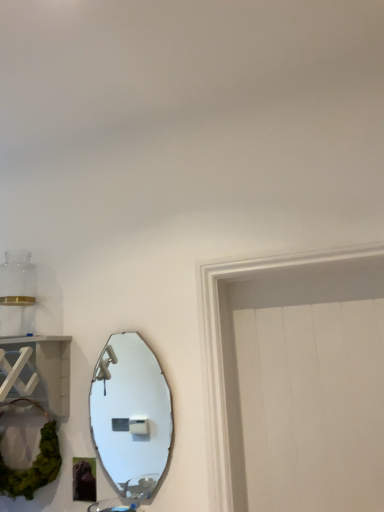
Question: Is matte silver mirror at center-left wider or thinner than white wood shelf at left?

Choices:
 (A) thin
 (B) wide

Answer: (A)

Question: Relative to white wood shelf at left, is matte silver mirror at center-left in front or behind?

Choices:
 (A) front
 (B) behind

Answer: (B)

Question: In terms of height, does matte silver mirror at center-left look taller or shorter compared to white wood shelf at left?

Choices:
 (A) short
 (B) tall

Answer: (B)

Question: From the image's perspective, is white wood shelf at left above or below matte silver mirror at center-left?

Choices:
 (A) above
 (B) below

Answer: (A)

Question: Is point (1, 355) positioned closer to the camera than point (125, 355)?

Choices:
 (A) farther
 (B) closer

Answer: (B)

Question: Do you think white wood shelf at left is within matte silver mirror at center-left, or outside of it?

Choices:
 (A) outside
 (B) inside

Answer: (A)

Question: Considering their positions, is white wood shelf at left located in front of or behind matte silver mirror at center-left?

Choices:
 (A) front
 (B) behind

Answer: (A)